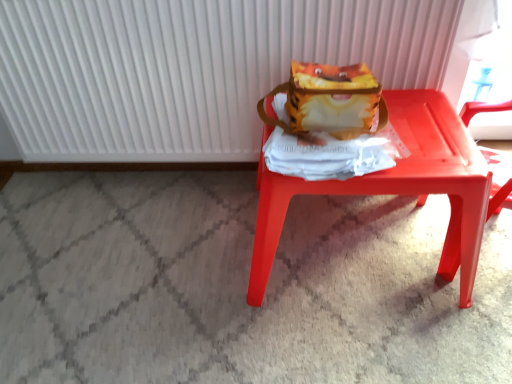
What are the coordinates of `white ribbed radiator at upper center` in the screenshot? It's located at (189, 69).

I want to click on matte yellow fabric shoulder bag at center, so click(x=329, y=101).

This screenshot has width=512, height=384. I want to click on matte plastic stool at center, so click(x=397, y=187).

From a real-world perspective, is white ribbed radiator at upper center positioned under matte plastic stool at center based on gravity?

No.

Is point (52, 32) behind point (441, 102)?

Yes, it is behind point (441, 102).

Consider the image. Considering the positions of objects white ribbed radiator at upper center and matte plastic stool at center in the image provided, who is in front, white ribbed radiator at upper center or matte plastic stool at center?

Positioned in front is matte plastic stool at center.

Is matte plastic stool at center next to white ribbed radiator at upper center and touching it?

They are not placed beside each other.

From a real-world perspective, relative to white ribbed radiator at upper center, is matte plastic stool at center vertically above or below?

From a real-world perspective, matte plastic stool at center is physically below white ribbed radiator at upper center.

Identify the location of radiator located above the matte plastic stool at center (from a real-world perspective). The width and height of the screenshot is (512, 384). (189, 69).

Which object is further away from the camera, matte plastic stool at center or white ribbed radiator at upper center?

white ribbed radiator at upper center is further away from the camera.

Which of these two, matte yellow fabric shoulder bag at center or white ribbed radiator at upper center, stands taller?

Standing taller between the two is white ribbed radiator at upper center.

Could you tell me if matte yellow fabric shoulder bag at center is facing white ribbed radiator at upper center?

No, matte yellow fabric shoulder bag at center is not oriented towards white ribbed radiator at upper center.

Is matte yellow fabric shoulder bag at center to the left or to the right of white ribbed radiator at upper center in the image?

Clearly, matte yellow fabric shoulder bag at center is on the right of white ribbed radiator at upper center in the image.

Which of these two, matte plastic stool at center or matte yellow fabric shoulder bag at center, stands taller?

matte plastic stool at center.

Consider the image. Which object is positioned more to the right, matte plastic stool at center or matte yellow fabric shoulder bag at center?

matte plastic stool at center.

What's the angular difference between matte plastic stool at center and matte yellow fabric shoulder bag at center's facing directions?

0.000183 degrees separate the facing orientations of matte plastic stool at center and matte yellow fabric shoulder bag at center.

Which object is wider, matte plastic stool at center or matte yellow fabric shoulder bag at center?

matte plastic stool at center is wider.

Consider the image. From the image's perspective, is white ribbed radiator at upper center on matte yellow fabric shoulder bag at center?

Yes.

Who is bigger, white ribbed radiator at upper center or matte yellow fabric shoulder bag at center?

white ribbed radiator at upper center is bigger.

Is white ribbed radiator at upper center aimed at matte yellow fabric shoulder bag at center?

Yes, white ribbed radiator at upper center faces towards matte yellow fabric shoulder bag at center.

Is matte yellow fabric shoulder bag at center wider than matte plastic stool at center?

No.

From a real-world perspective, does matte yellow fabric shoulder bag at center stand above matte plastic stool at center?

Yes, from a real-world perspective, matte yellow fabric shoulder bag at center is over matte plastic stool at center

Are matte yellow fabric shoulder bag at center and matte plastic stool at center far apart?

They are positioned close to each other.

In the image, is matte yellow fabric shoulder bag at center positioned in front of or behind matte plastic stool at center?

matte yellow fabric shoulder bag at center is behind matte plastic stool at center.

Locate an element on the screen. The height and width of the screenshot is (384, 512). radiator positioned vertically above the matte plastic stool at center (from a real-world perspective) is located at coordinates (189, 69).

Where is `radiator behind the matte plastic stool at center`? The image size is (512, 384). radiator behind the matte plastic stool at center is located at coordinates (189, 69).

When comparing their distances from matte plastic stool at center, does matte yellow fabric shoulder bag at center or white ribbed radiator at upper center seem closer?

matte yellow fabric shoulder bag at center lies closer to matte plastic stool at center than the other object.

Which object lies nearer to the anchor point matte plastic stool at center, white ribbed radiator at upper center or matte yellow fabric shoulder bag at center?

matte yellow fabric shoulder bag at center is positioned closer to the anchor matte plastic stool at center.

Which object lies nearer to the anchor point white ribbed radiator at upper center, matte yellow fabric shoulder bag at center or matte plastic stool at center?

Among the two, matte yellow fabric shoulder bag at center is located nearer to white ribbed radiator at upper center.

Estimate the real-world distances between objects in this image. Which object is closer to matte yellow fabric shoulder bag at center, white ribbed radiator at upper center or matte plastic stool at center?

Based on the image, matte plastic stool at center appears to be nearer to matte yellow fabric shoulder bag at center.

Estimate the real-world distances between objects in this image. Which object is further from white ribbed radiator at upper center, matte plastic stool at center or matte yellow fabric shoulder bag at center?

matte plastic stool at center is positioned further to the anchor white ribbed radiator at upper center.

Estimate the real-world distances between objects in this image. Which object is further from matte yellow fabric shoulder bag at center, matte plastic stool at center or white ribbed radiator at upper center?

white ribbed radiator at upper center.

Find the location of `shoulder bag between white ribbed radiator at upper center and matte plastic stool at center from left to right`. shoulder bag between white ribbed radiator at upper center and matte plastic stool at center from left to right is located at coordinates (329, 101).